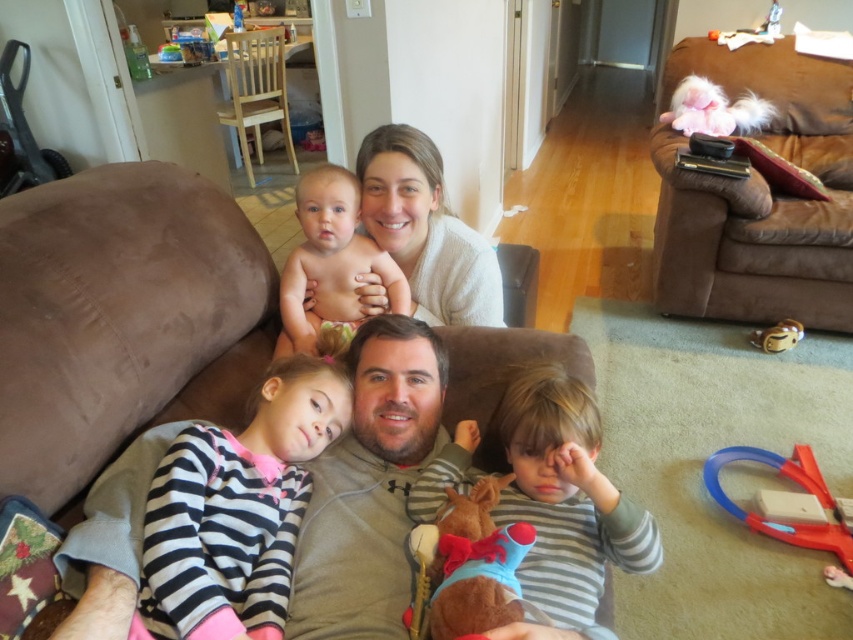
Who is taller, brown fabric couch at center or light wood chair at upper left?

With more height is light wood chair at upper left.

Consider the image. Can you confirm if brown fabric couch at center is bigger than light wood chair at upper left?

No, brown fabric couch at center is not bigger than light wood chair at upper left.

Is point (213, 349) positioned in front of point (247, 100)?

Yes, point (213, 349) is closer to viewer.

You are a GUI agent. You are given a task and a screenshot of the screen. Output one action in this format:
    pyautogui.click(x=<x>, y=<y>)
    Task: Click on the brown fabric couch at center
    
    Given the screenshot: What is the action you would take?
    pyautogui.click(x=122, y=321)

Based on the photo, who is positioned more to the right, blue plastic train at lower right or matte gold ring at lower right?

matte gold ring at lower right is more to the right.

How distant is blue plastic train at lower right from matte gold ring at lower right?

A distance of 29.99 inches exists between blue plastic train at lower right and matte gold ring at lower right.

The height and width of the screenshot is (640, 853). What are the coordinates of `blue plastic train at lower right` in the screenshot? It's located at (798, 484).

Which of these two, brown suede armchair at upper right or white soft sweater at upper center, stands shorter?

white soft sweater at upper center is shorter.

Between point (680, 308) and point (448, 216), which one is positioned behind?

Point (680, 308)

Is point (776, 282) positioned after point (445, 228)?

That is True.

In order to click on brown suede armchair at upper right in this screenshot , I will do `click(759, 196)`.